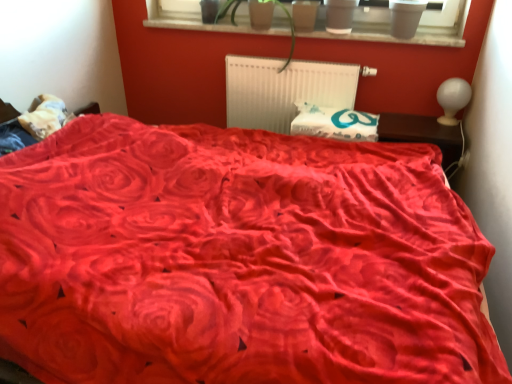
At what (x,y) coordinates should I click in order to perform the action: click on white plastic radiator at center. Please return your answer as a coordinate pair (x, y). Looking at the image, I should click on tap(283, 90).

The width and height of the screenshot is (512, 384). Identify the location of white glossy lampshade at upper right. (452, 99).

Image resolution: width=512 pixels, height=384 pixels. Describe the element at coordinates (238, 260) in the screenshot. I see `velvet red bed at center` at that location.

Locate an element on the screen. The width and height of the screenshot is (512, 384). green leafy plant at upper center is located at coordinates (289, 25).

What do you see at coordinates (340, 16) in the screenshot? The image size is (512, 384). I see `matte gray flowerpot at upper center, the first flowerpot from the right` at bounding box center [340, 16].

At what (x,y) coordinates should I click in order to perform the action: click on white plastic radiator at center. Please return your answer as a coordinate pair (x, y). Looking at the image, I should click on (283, 90).

Relative to matte plastic flowerpot at upper center, acting as the first flowerpot starting from the left, is brown wooden table at right in front or behind?

In the image, brown wooden table at right appears in front of matte plastic flowerpot at upper center, acting as the first flowerpot starting from the left.

Is brown wooden table at right aimed at matte plastic flowerpot at upper center, placed as the 2th flowerpot when sorted from right to left?

No, brown wooden table at right is not oriented towards matte plastic flowerpot at upper center, placed as the 2th flowerpot when sorted from right to left.

Is brown wooden table at right not near matte plastic flowerpot at upper center, acting as the first flowerpot starting from the left?

Absolutely, brown wooden table at right is distant from matte plastic flowerpot at upper center, acting as the first flowerpot starting from the left.

Considering the points (325, 127) and (280, 5), which point is in front, point (325, 127) or point (280, 5)?

The point (325, 127) is closer to the camera.

Between white fabric pillow at center and green leafy plant at upper center, which one has smaller width?

white fabric pillow at center.

Is white fabric pillow at center smaller than green leafy plant at upper center?

Yes.

Is white fabric pillow at center not inside green leafy plant at upper center?

Yes, white fabric pillow at center is not within green leafy plant at upper center.

Based on the photo, how different are the orientations of white glossy lampshade at upper right and brown wooden table at right in degrees?

white glossy lampshade at upper right and brown wooden table at right are facing 1.01 degrees away from each other.

Is white glossy lampshade at upper right directly adjacent to brown wooden table at right?

No, white glossy lampshade at upper right is not with brown wooden table at right.

Considering the positions of objects white glossy lampshade at upper right and brown wooden table at right in the image provided, who is behind, white glossy lampshade at upper right or brown wooden table at right?

white glossy lampshade at upper right is further from the camera.

Could you tell me if white glossy lampshade at upper right is facing brown wooden table at right?

No, white glossy lampshade at upper right is not aimed at brown wooden table at right.

Is white plastic radiator at center positioned with its back to matte plastic pots at upper center?

No.

Based on the photo, how different are the orientations of white plastic radiator at center and matte plastic pots at upper center in degrees?

0.246 degrees separate the facing orientations of white plastic radiator at center and matte plastic pots at upper center.

Does white plastic radiator at center come behind matte plastic pots at upper center?

Yes, white plastic radiator at center is further from the camera.

Is white plastic radiator at center located outside matte plastic pots at upper center?

white plastic radiator at center lies outside matte plastic pots at upper center's area.

Choose the correct answer: Is brown wooden table at right inside white fabric pillow at left or outside it?

brown wooden table at right is outside white fabric pillow at left.

This screenshot has width=512, height=384. I want to click on table on the right of white fabric pillow at left, so click(424, 135).

From a real-world perspective, is brown wooden table at right positioned above or below white fabric pillow at left?

brown wooden table at right is below white fabric pillow at left.

Considering the relative sizes of brown wooden table at right and white fabric pillow at left in the image provided, is brown wooden table at right bigger than white fabric pillow at left?

Correct, brown wooden table at right is larger in size than white fabric pillow at left.

Which is more to the right, matte plastic pots at upper center or smooth wood window sill at upper center?

From the viewer's perspective, matte plastic pots at upper center appears more on the right side.

Is smooth wood window sill at upper center a part of matte plastic pots at upper center?

No, smooth wood window sill at upper center is not a part of matte plastic pots at upper center.

Consider the image. From the image's perspective, which one is positioned lower, matte plastic pots at upper center or smooth wood window sill at upper center?

smooth wood window sill at upper center is shown below in the image.

Which object is wider, velvet red bed at center or brown wooden table at right?

velvet red bed at center is wider.

Is velvet red bed at center facing away from brown wooden table at right?

That's not correct — velvet red bed at center is not looking away from brown wooden table at right.

Based on the photo, is velvet red bed at center far away from brown wooden table at right?

Yes, velvet red bed at center is far from brown wooden table at right.

How far apart are velvet red bed at center and brown wooden table at right?

velvet red bed at center and brown wooden table at right are 1.08 meters apart from each other.

The width and height of the screenshot is (512, 384). In order to click on table in front of the matte plastic flowerpot at upper center, placed as the 2th flowerpot when sorted from right to left in this screenshot , I will do `click(424, 135)`.

Where is `pillow behind the green leafy plant at upper center`? pillow behind the green leafy plant at upper center is located at coordinates pos(334,123).

Consider the image. Considering their positions, is white fabric pillow at left positioned further to smooth wood window sill at upper center than white plastic radiator at center?

Among the two, white fabric pillow at left is located further to smooth wood window sill at upper center.

Looking at the image, which one is located closer to green leafy plant at upper center, brown wooden table at right or matte plastic pots at upper center?

The object closer to green leafy plant at upper center is matte plastic pots at upper center.

Which object lies further to the anchor point matte gray flowerpot at upper center, marked as the 2th flowerpot in a left-to-right arrangement, brown wooden table at right or matte plastic pots at upper center?

Based on the image, brown wooden table at right appears to be further to matte gray flowerpot at upper center, marked as the 2th flowerpot in a left-to-right arrangement.

From the image, which object appears to be farther from white plastic radiator at center, white fabric pillow at left or white glossy lampshade at upper right?

The object further to white plastic radiator at center is white fabric pillow at left.

When comparing their distances from velvet red bed at center, does white fabric pillow at center or matte plastic flowerpot at upper center, placed as the 2th flowerpot when sorted from right to left, seem further?

Based on the image, matte plastic flowerpot at upper center, placed as the 2th flowerpot when sorted from right to left, appears to be further to velvet red bed at center.

Based on their spatial positions, is white fabric pillow at left or smooth wood window sill at upper center closer to brown wooden table at right?

The object closer to brown wooden table at right is smooth wood window sill at upper center.

Which object lies further to the anchor point green leafy plant at upper center, brown wooden table at right or white fabric pillow at center?

Among the two, brown wooden table at right is located further to green leafy plant at upper center.

When comparing their distances from smooth wood window sill at upper center, does matte plastic pots at upper center or green leafy plant at upper center seem further?

Among the two, matte plastic pots at upper center is located further to smooth wood window sill at upper center.

The width and height of the screenshot is (512, 384). What are the coordinates of `radiator between green leafy plant at upper center and white glossy lampshade at upper right` in the screenshot? It's located at (283, 90).

Locate an element on the screen. The width and height of the screenshot is (512, 384). window screen between velvet red bed at center and matte plastic flowerpot at upper center, placed as the 2th flowerpot when sorted from right to left, in the front-back direction is located at coordinates (442, 14).

Image resolution: width=512 pixels, height=384 pixels. In order to click on window sill located between white fabric pillow at left and matte gray flowerpot at upper center, the first flowerpot from the right, in the left-right direction in this screenshot , I will do `click(390, 38)`.

You are a GUI agent. You are given a task and a screenshot of the screen. Output one action in this format:
    pyautogui.click(x=<x>, y=<y>)
    Task: Click on the table between velvet red bed at center and white glossy lampshade at upper right in the front-back direction
    The image size is (512, 384).
    Given the screenshot: What is the action you would take?
    pyautogui.click(x=424, y=135)